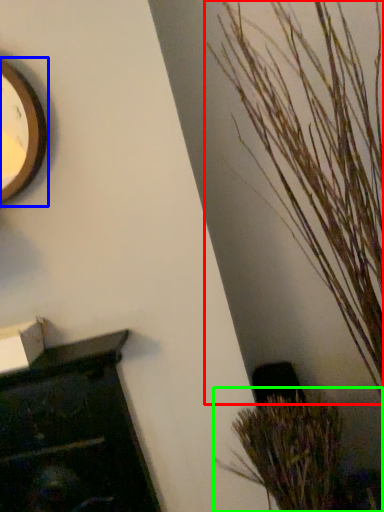
Question: Estimate the real-world distances between objects in this image. Which object is farther from houseplant (highlighted by a red box), clock (highlighted by a blue box) or houseplant (highlighted by a green box)?

Choices:
 (A) clock
 (B) houseplant

Answer: (A)